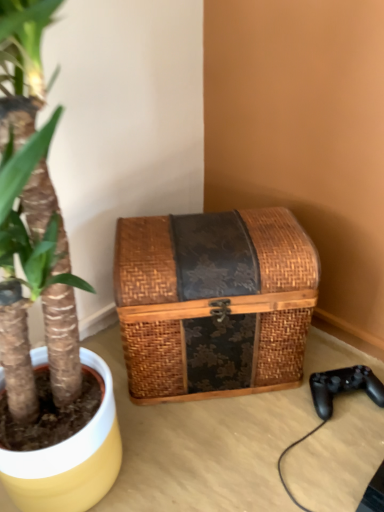
This screenshot has height=512, width=384. Describe the element at coordinates (214, 301) in the screenshot. I see `woven wood chest at center` at that location.

Find the location of a particular element. woven wood chest at center is located at coordinates tap(214, 301).

Where is `woven wood chest at center`? The height and width of the screenshot is (512, 384). woven wood chest at center is located at coordinates (214, 301).